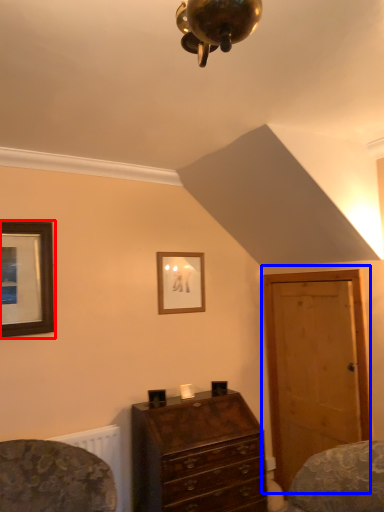
Question: Which point is closer to the camera, picture frame (highlighted by a red box) or door (highlighted by a blue box)?

Choices:
 (A) picture frame
 (B) door

Answer: (A)